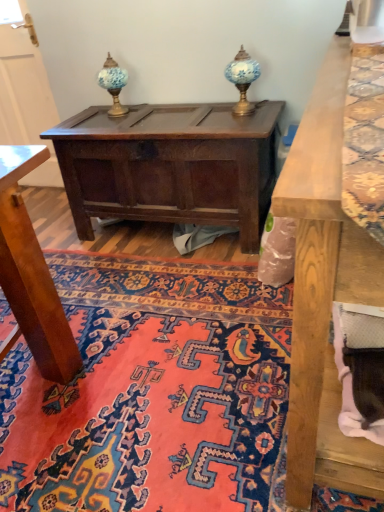
Question: From a real-world perspective, relative to blue glass table lamp at upper center, positioned as the 1th table lamp in right-to-left order, is dark brown wood chest at center vertically above or below?

Choices:
 (A) below
 (B) above

Answer: (A)

Question: Would you say dark brown wood chest at center is to the left or to the right of blue glass table lamp at upper center, the second table lamp from the left, in the picture?

Choices:
 (A) left
 (B) right

Answer: (A)

Question: Which object is positioned farthest from the blue glass table lamp at upper center, arranged as the 2th table lamp when viewed from the right?

Choices:
 (A) carpet with intricate patterns at center
 (B) blue glass table lamp at upper center, the second table lamp from the left
 (C) dark brown wood chest at center

Answer: (A)

Question: Estimate the real-world distances between objects in this image. Which object is farther from the dark brown wood chest at center?

Choices:
 (A) blue glass table lamp at upper center, the second table lamp from the left
 (B) blue glass table lamp at upper center, which is counted as the 1th table lamp, starting from the left
 (C) carpet with intricate patterns at center

Answer: (C)